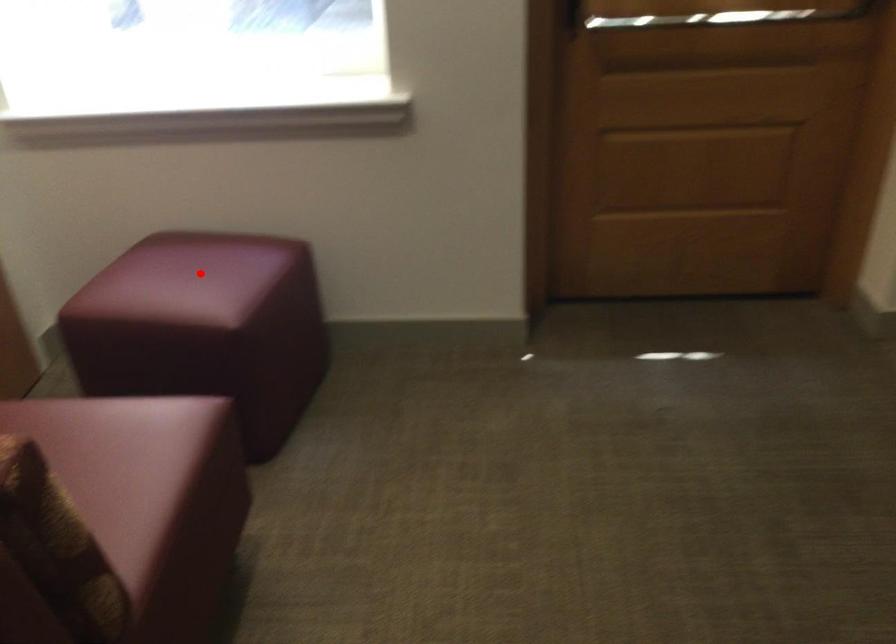
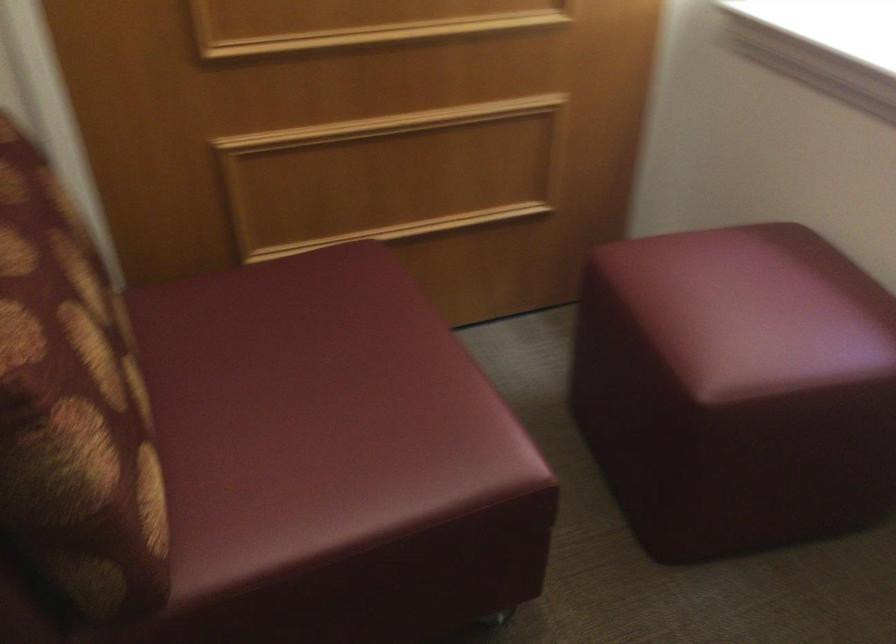
In the second image, find the point that corresponds to the highlighted location in the first image.

(752, 308)